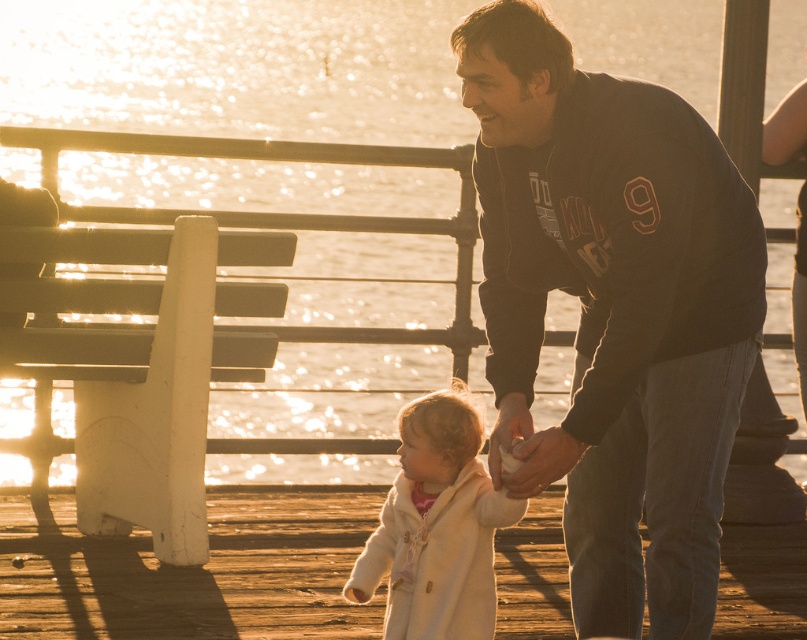
Question: Which point is closer to the camera?

Choices:
 (A) dark gray hoodie at center
 (B) white fleece coat at center

Answer: (A)

Question: Which point is closer to the camera taking this photo?

Choices:
 (A) (412, 621)
 (B) (630, 572)

Answer: (A)

Question: Considering the relative positions of dark gray hoodie at center and white fleece coat at center in the image provided, where is dark gray hoodie at center located with respect to white fleece coat at center?

Choices:
 (A) above
 (B) below

Answer: (A)

Question: Is dark gray hoodie at center smaller than white fleece coat at center?

Choices:
 (A) yes
 (B) no

Answer: (B)

Question: Is dark gray hoodie at center above white fleece coat at center?

Choices:
 (A) yes
 (B) no

Answer: (A)

Question: Which point appears farthest from the camera in this image?

Choices:
 (A) (592, 508)
 (B) (400, 470)

Answer: (B)